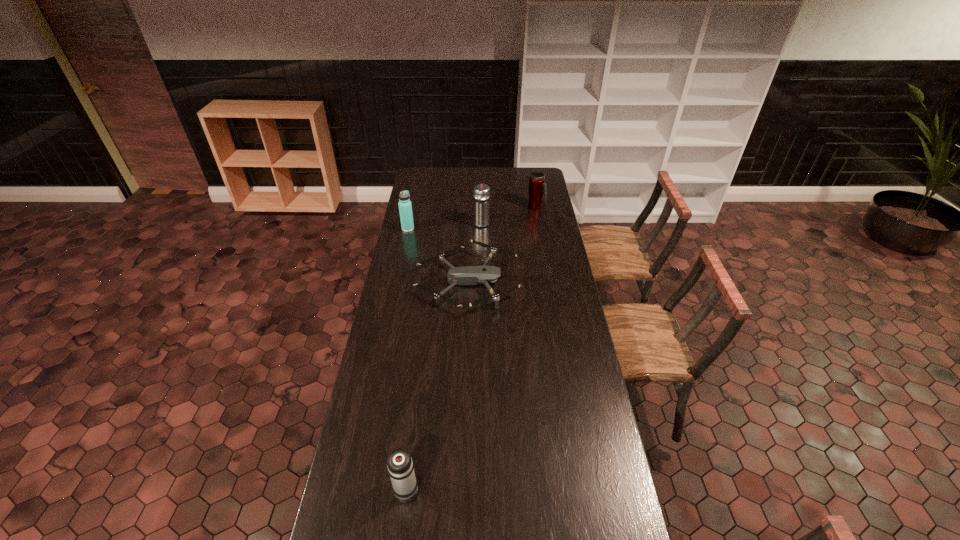
This screenshot has height=540, width=960. I want to click on free space located with a handle on the side of the second thermos bottle from right to left, so click(482, 210).

Locate an element on the screen. This screenshot has width=960, height=540. free space located on the front of the leftmost thermos bottle is located at coordinates (400, 266).

This screenshot has height=540, width=960. Identify the location of free region located on the side with the handle of the third thermos bottle from right to left. (420, 369).

In order to click on free location located on the side with the handle of the third thermos bottle from right to left in this screenshot , I will do (411, 444).

You are a GUI agent. You are given a task and a screenshot of the screen. Output one action in this format:
    pyautogui.click(x=<x>, y=<y>)
    Task: Click on the free region located on the side with the handle of the third thermos bottle from right to left
    The image size is (960, 540).
    Given the screenshot: What is the action you would take?
    pyautogui.click(x=420, y=369)

Identify the location of free location located 0.220m with a camera mounted on the front of the second nearest object. The width and height of the screenshot is (960, 540). 567,281.

You are a GUI agent. You are given a task and a screenshot of the screen. Output one action in this format:
    pyautogui.click(x=<x>, y=<y>)
    Task: Click on the drone present at the left edge
    The height and width of the screenshot is (540, 960).
    Given the screenshot: What is the action you would take?
    pyautogui.click(x=466, y=275)

Locate an element on the screen. This screenshot has width=960, height=540. object present at the right edge is located at coordinates (537, 186).

The width and height of the screenshot is (960, 540). Find the location of `vacant area at the far edge of the desktop`. vacant area at the far edge of the desktop is located at coordinates (466, 178).

Identify the location of blank area at the left edge. This screenshot has width=960, height=540. (349, 449).